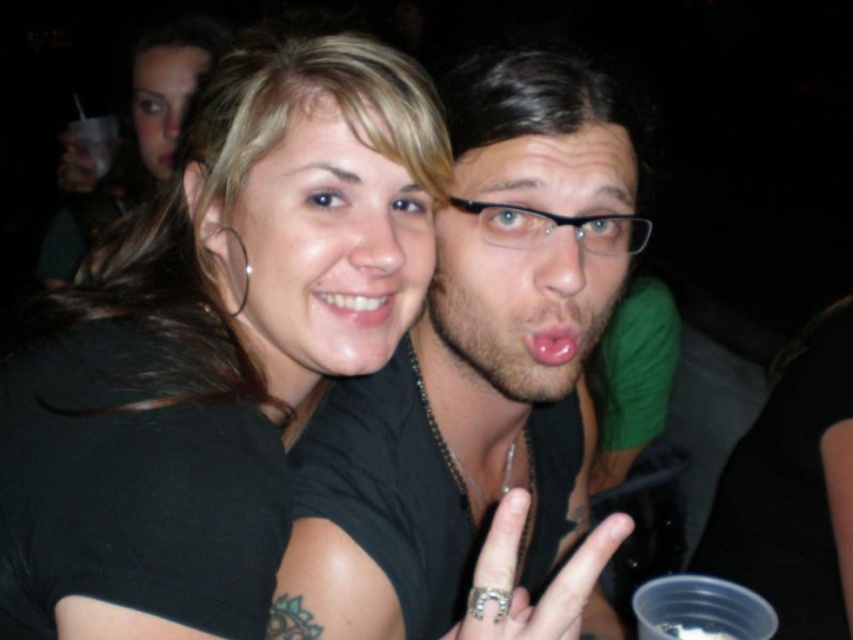
Between black matte hair at upper left and black plastic glasses at center, which one has more height?

Standing taller between the two is black matte hair at upper left.

Is black matte hair at upper left positioned behind black plastic glasses at center?

That is False.

Which is behind, point (334, 250) or point (636, 250)?

Point (636, 250)

Where is `black matte hair at upper left`? This screenshot has height=640, width=853. black matte hair at upper left is located at coordinates (207, 352).

Is point (500, 371) positioned behind point (169, 83)?

No, (500, 371) is in front of (169, 83).

Who is positioned more to the right, matte black face at center or smooth skin face at upper left?

matte black face at center

Who is more distant from viewer, (563, 157) or (183, 106)?

Positioned behind is point (183, 106).

This screenshot has width=853, height=640. In order to click on matte black face at center in this screenshot , I will do `click(531, 259)`.

Can you confirm if black matte hair at upper left is taller than matte black face at center?

Yes.

Consider the image. Who is shorter, black matte hair at upper left or matte black face at center?

With less height is matte black face at center.

What do you see at coordinates (207, 352) in the screenshot? This screenshot has width=853, height=640. I see `black matte hair at upper left` at bounding box center [207, 352].

Identify the location of black matte hair at upper left. (207, 352).